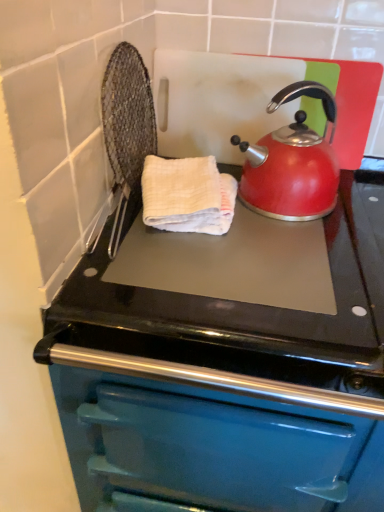
The width and height of the screenshot is (384, 512). What do you see at coordinates (226, 383) in the screenshot? I see `teal enamel oven at center` at bounding box center [226, 383].

Measure the distance between shiny red kettle at upper right and camera.

A distance of 30.63 inches exists between shiny red kettle at upper right and camera.

Measure the distance between point (x=209, y=187) and camera.

Point (x=209, y=187) is 78.90 centimeters from camera.

The image size is (384, 512). In order to click on teal enamel oven at center in this screenshot , I will do `click(226, 383)`.

You are a GUI agent. You are given a task and a screenshot of the screen. Output one action in this format:
    pyautogui.click(x=<x>, y=<y>)
    Task: Click on the hand towel that appears below the shiny red kettle at upper right (from a real-world perspective)
    The image size is (384, 512).
    Given the screenshot: What is the action you would take?
    pyautogui.click(x=187, y=195)

Does point (252, 156) come behind point (223, 228)?

Yes, point (252, 156) is farther from viewer.

Is shiny red kettle at upper right inside or outside of white textured hand towel at center?

shiny red kettle at upper right is not enclosed by white textured hand towel at center.

Is shiny red kettle at upper right facing towards white textured hand towel at center?

No.

Would you consider teal enamel oven at center to be distant from white textured hand towel at center?

No, teal enamel oven at center is not far from white textured hand towel at center.

Find the location of `oven on the right of white textured hand towel at center`. oven on the right of white textured hand towel at center is located at coordinates (226, 383).

How distant is teal enamel oven at center from white textured hand towel at center?

teal enamel oven at center is 10.85 inches from white textured hand towel at center.

From the image's perspective, relative to shiny red kettle at upper right, is white textured hand towel at center above or below?

white textured hand towel at center is below shiny red kettle at upper right.

Identify the location of kettle that appears above the white textured hand towel at center (from the image's perspective). This screenshot has height=512, width=384. (289, 173).

Based on the photo, is white textured hand towel at center facing towards shiny red kettle at upper right?

No, white textured hand towel at center is not oriented towards shiny red kettle at upper right.

From the image's perspective, which one is positioned higher, teal enamel oven at center or shiny red kettle at upper right?

shiny red kettle at upper right appears higher in the image.

Which point is more forward, (x=380, y=249) or (x=313, y=194)?

The point (x=380, y=249) is closer.

Is teal enamel oven at center wider or thinner than shiny red kettle at upper right?

teal enamel oven at center is wider than shiny red kettle at upper right.

In the image, is white textured hand towel at center on the left side or the right side of teal enamel oven at center?

Based on their positions, white textured hand towel at center is located to the left of teal enamel oven at center.

How many degrees apart are the facing directions of white textured hand towel at center and teal enamel oven at center?

0.296 degrees separate the facing orientations of white textured hand towel at center and teal enamel oven at center.

From the picture: Considering the relative sizes of white textured hand towel at center and teal enamel oven at center in the image provided, is white textured hand towel at center wider than teal enamel oven at center?

Incorrect, the width of white textured hand towel at center does not surpass that of teal enamel oven at center.

Considering the relative positions of white textured hand towel at center and teal enamel oven at center in the image provided, is white textured hand towel at center in front of teal enamel oven at center?

No, the depth of white textured hand towel at center is greater than that of teal enamel oven at center.

The image size is (384, 512). In the image, there is a teal enamel oven at center. In order to click on kettle above it (from the image's perspective) in this screenshot , I will do `click(289, 173)`.

From the image's perspective, which is above, shiny red kettle at upper right or teal enamel oven at center?

shiny red kettle at upper right.

Is shiny red kettle at upper right spatially inside teal enamel oven at center, or outside of it?

shiny red kettle at upper right is not inside teal enamel oven at center, it's outside.

Can you confirm if shiny red kettle at upper right is bigger than teal enamel oven at center?

No, shiny red kettle at upper right is not bigger than teal enamel oven at center.

Locate an element on the screen. kettle in front of the white textured hand towel at center is located at coordinates (289, 173).

This screenshot has width=384, height=512. In order to click on hand towel above the teal enamel oven at center (from a real-world perspective) in this screenshot , I will do `click(187, 195)`.

Based on their spatial positions, is white textured hand towel at center or teal enamel oven at center closer to shiny red kettle at upper right?

white textured hand towel at center is positioned closer to the anchor shiny red kettle at upper right.

Based on their spatial positions, is teal enamel oven at center or shiny red kettle at upper right further from white textured hand towel at center?

Based on the image, teal enamel oven at center appears to be further to white textured hand towel at center.

When comparing their distances from shiny red kettle at upper right, does teal enamel oven at center or white textured hand towel at center seem closer?

Among the two, white textured hand towel at center is located nearer to shiny red kettle at upper right.

Looking at the image, which one is located further to white textured hand towel at center, shiny red kettle at upper right or teal enamel oven at center?

Among the two, teal enamel oven at center is located further to white textured hand towel at center.

Which object lies nearer to the anchor point teal enamel oven at center, white textured hand towel at center or shiny red kettle at upper right?

Based on the image, white textured hand towel at center appears to be nearer to teal enamel oven at center.

From the image, which object appears to be farther from teal enamel oven at center, shiny red kettle at upper right or white textured hand towel at center?

The object further to teal enamel oven at center is shiny red kettle at upper right.

The image size is (384, 512). I want to click on hand towel between shiny red kettle at upper right and teal enamel oven at center from top to bottom, so tap(187, 195).